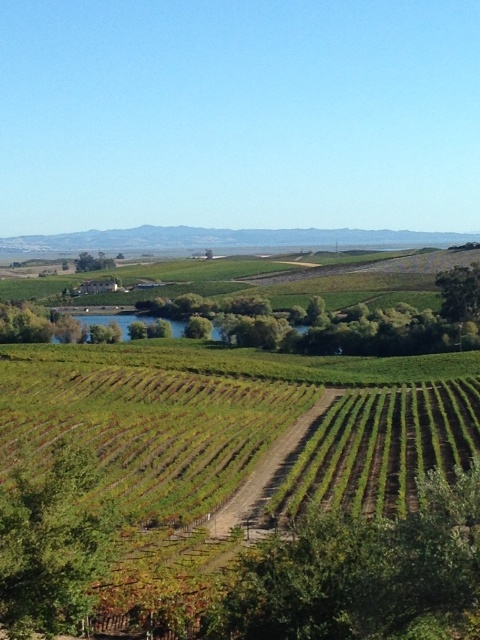
Question: Is green leafy tree at lower left wider than green leafy tree at center-left?

Choices:
 (A) no
 (B) yes

Answer: (A)

Question: Which point is closer to the camera?

Choices:
 (A) (444, 291)
 (B) (108, 257)
 (C) (94, 577)

Answer: (C)

Question: Does green leafy tree at upper right appear under green leafy tree at center-left?

Choices:
 (A) yes
 (B) no

Answer: (A)

Question: Which point is farther from the camera taking this photo?

Choices:
 (A) (108, 544)
 (B) (110, 259)
 (C) (443, 285)

Answer: (B)

Question: Among these points, which one is farthest from the camera?

Choices:
 (A) (468, 273)
 (B) (49, 566)
 (C) (110, 257)

Answer: (C)

Question: Can you confirm if green leafy tree at lower left is smaller than green leafy tree at upper right?

Choices:
 (A) no
 (B) yes

Answer: (B)